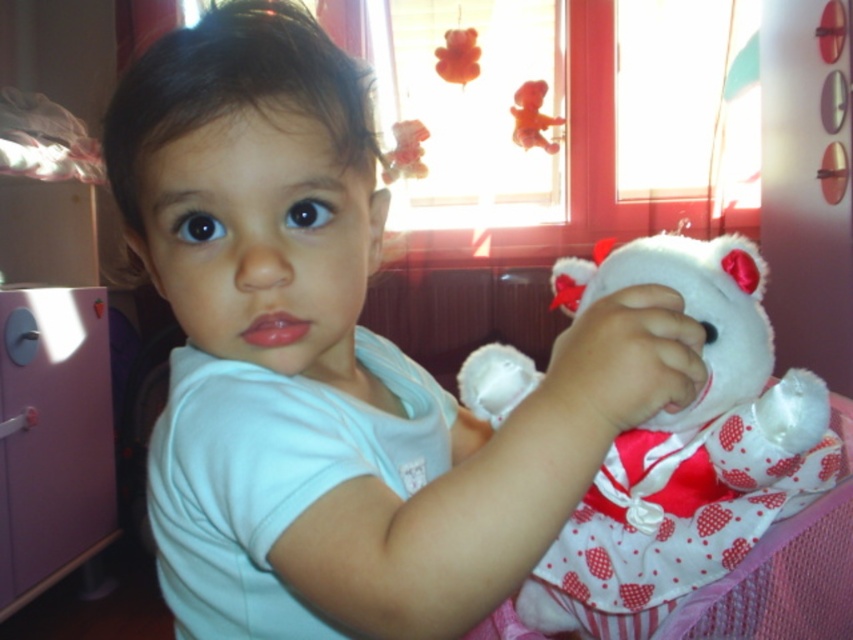
You are organizing a teddy bear collection in the cozy room. You have to place the white soft teddy bear at center and the fuzzy brown teddy bear at upper right on a shelf. The shelf can only hold items up to the size of the smaller teddy bear. Which teddy bear cannot be placed on the shelf?

The white soft teddy bear at center cannot be placed on the shelf because it is larger than the fuzzy brown teddy bear at upper right, exceeding the shelf size limit.

You are a toy bear trying to find your owner in the room. You are currently on the pink cabinet with a circular handle to the left. The owner is wearing the white soft shirt at center. In which direction should you move to reach the owner?

The white soft shirt at center is located at point (253, 192), so you should move towards the center of the room from the pink cabinet to reach the owner.

You are helping to organize a child playroom. You see the white soft shirt at center and the white soft teddy bear at center. Which object is positioned to the left of the other?

The white soft shirt at center is to the left of the white soft teddy bear at center.